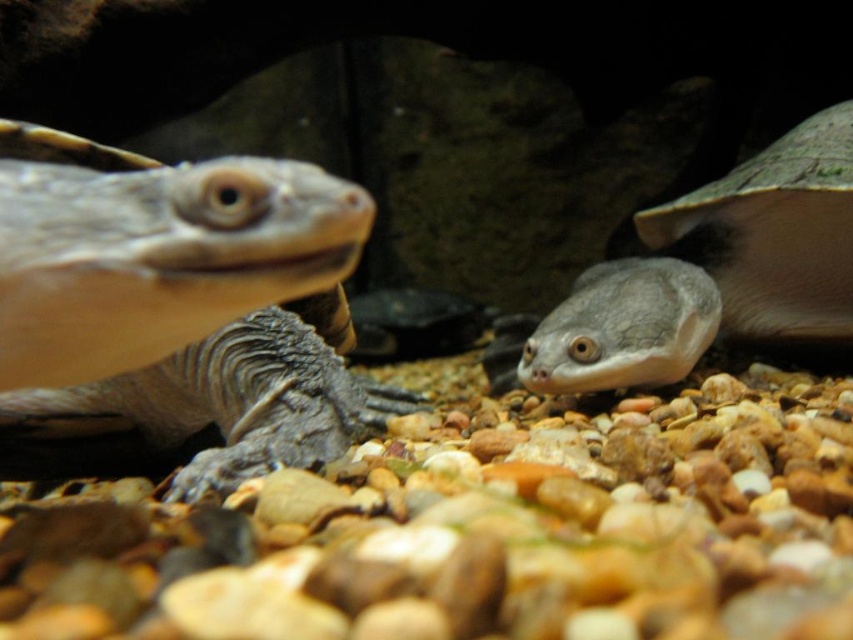
You are a zookeeper responsible for feeding the turtles in the aquarium. You need to place a small food dish between the smooth brown tortoise at left and the matte gray tortoise at right. Which turtle should you place the dish closer to if you want it to be equidistant from both?

To place the dish equidistant between the smooth brown tortoise at left and the matte gray tortoise at right, you should position it closer to the smooth brown tortoise at left since it is smaller and requires less space.